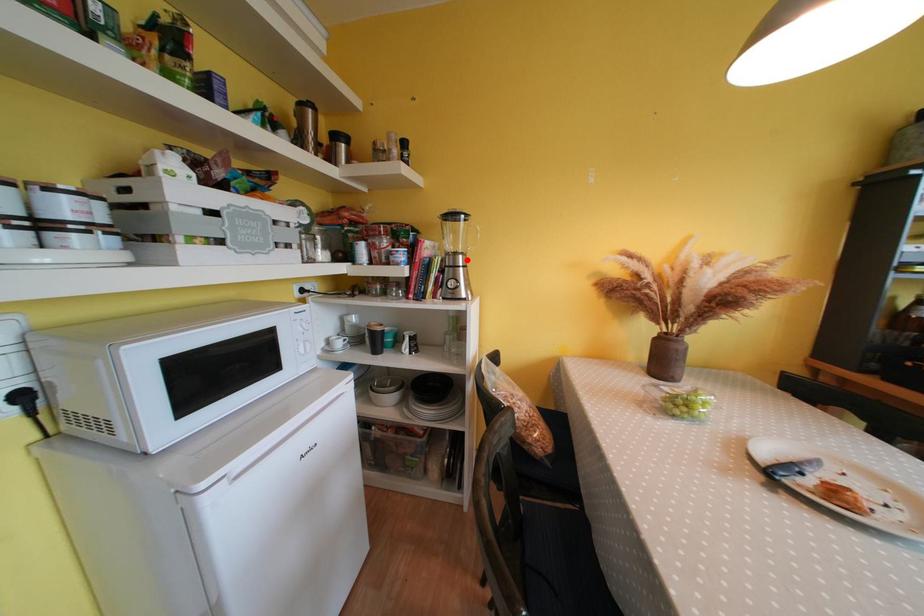
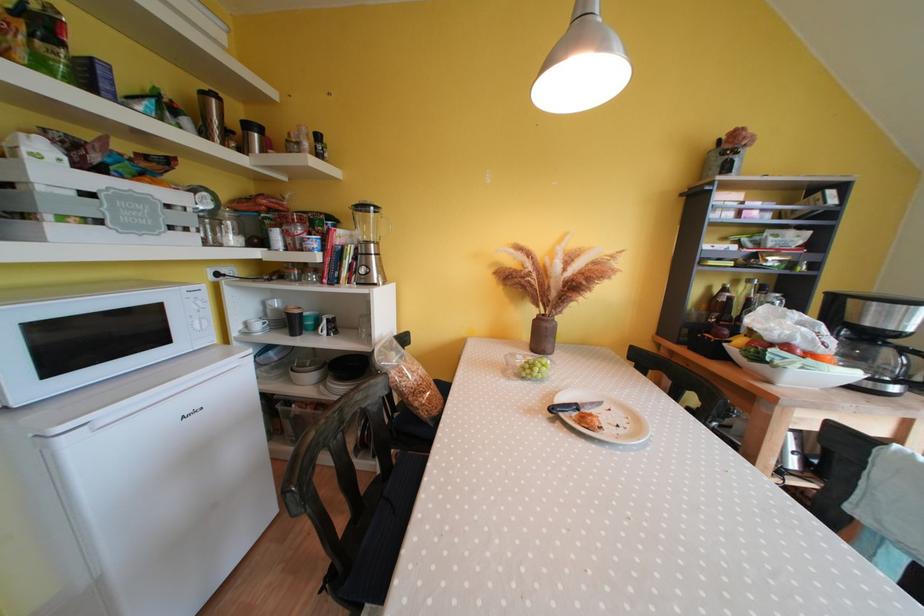
In the second image, find the point that corresponds to the highlighted location in the first image.

(379, 249)